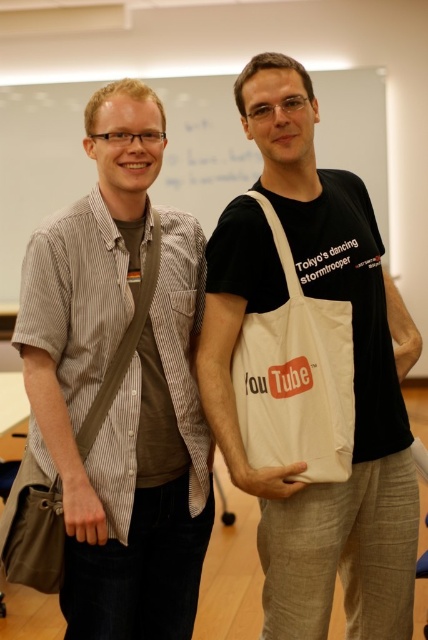
You are standing in a classroom and need to reach a point marked at coordinates (300, 172). If your arm can extend 1.5 meters, can you reach that point without moving closer?

The distance of point (300, 172) from camera is 1.69 meters, so no, you cannot reach it with an arm extension of 1.5 meters since it is farther away.

You are a delivery person who needs to place a small package between the striped cotton shirt at left and the white cotton tote bag at center. Can you fit it there?

The distance between the striped cotton shirt at left and the white cotton tote bag at center is 12.66 inches, so yes, the small package can be placed between them as the space is sufficient.

You are standing in a classroom and see a whiteboard. There is a point marked at coordinates (36,164). Where exactly is this point located?

The point is on the white matte board at upper center.